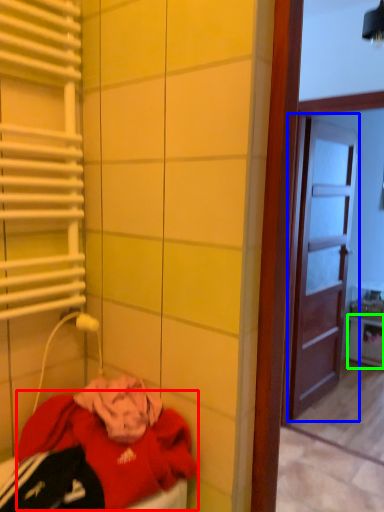
Question: Which object is the farthest from clothing (highlighted by a red box)? Choose among these: door (highlighted by a blue box) or cabinetry (highlighted by a green box).

Choices:
 (A) door
 (B) cabinetry

Answer: (B)